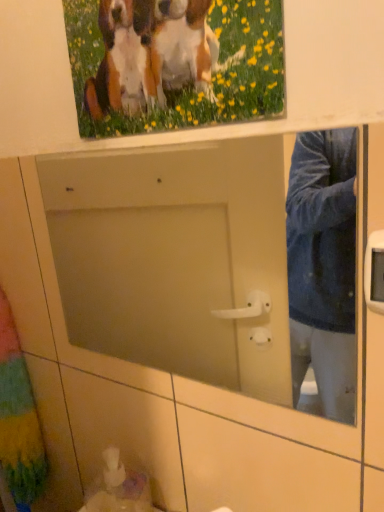
Question: Should I look upward or downward to see white glossy sink at lower left?

Choices:
 (A) up
 (B) down

Answer: (B)

Question: Are multicolored fabric curtain at left and white glossy sink at lower left far apart?

Choices:
 (A) no
 (B) yes

Answer: (A)

Question: Does multicolored fabric curtain at left have a greater width compared to white glossy sink at lower left?

Choices:
 (A) yes
 (B) no

Answer: (A)

Question: Considering the relative sizes of multicolored fabric curtain at left and white glossy sink at lower left in the image provided, is multicolored fabric curtain at left bigger than white glossy sink at lower left?

Choices:
 (A) no
 (B) yes

Answer: (B)

Question: Does multicolored fabric curtain at left come in front of white glossy sink at lower left?

Choices:
 (A) yes
 (B) no

Answer: (B)

Question: Is multicolored fabric curtain at left shorter than white glossy sink at lower left?

Choices:
 (A) yes
 (B) no

Answer: (B)

Question: From a real-world perspective, is multicolored fabric curtain at left physically below white glossy sink at lower left?

Choices:
 (A) yes
 (B) no

Answer: (B)

Question: Considering the relative sizes of wooden picture frame at upper center and white glossy sink at lower left in the image provided, is wooden picture frame at upper center bigger than white glossy sink at lower left?

Choices:
 (A) yes
 (B) no

Answer: (A)

Question: From a real-world perspective, is wooden picture frame at upper center physically below white glossy sink at lower left?

Choices:
 (A) yes
 (B) no

Answer: (B)

Question: Is wooden picture frame at upper center facing towards white glossy sink at lower left?

Choices:
 (A) yes
 (B) no

Answer: (B)

Question: Does wooden picture frame at upper center have a lesser width compared to white glossy sink at lower left?

Choices:
 (A) yes
 (B) no

Answer: (A)

Question: Is wooden picture frame at upper center positioned in front of white glossy sink at lower left?

Choices:
 (A) yes
 (B) no

Answer: (A)

Question: Considering the relative sizes of wooden picture frame at upper center and white glossy sink at lower left in the image provided, is wooden picture frame at upper center wider than white glossy sink at lower left?

Choices:
 (A) yes
 (B) no

Answer: (B)

Question: From a real-world perspective, is white glossy sink at lower left on top of multicolored fabric curtain at left?

Choices:
 (A) no
 (B) yes

Answer: (A)